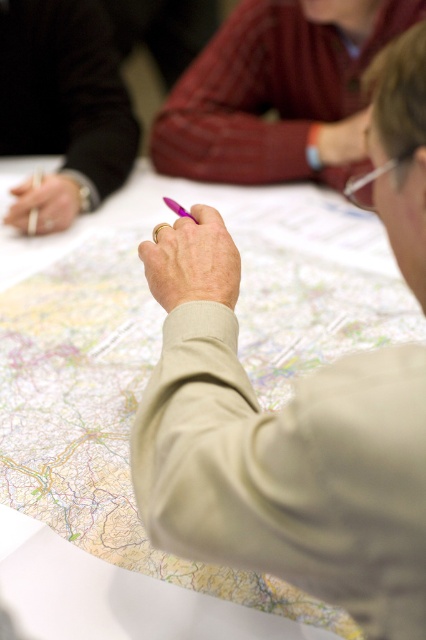
Question: Can you confirm if matte red sweater at upper center is wider than matte black pen at upper left?

Choices:
 (A) no
 (B) yes

Answer: (B)

Question: Which point is closer to the camera?

Choices:
 (A) (368, 8)
 (B) (117, 182)

Answer: (A)

Question: Based on their relative distances, which object is nearer to the matte red sweater at upper center?

Choices:
 (A) purple plastic pen at center
 (B) beige paper map at center

Answer: (B)

Question: Considering the relative positions of beige paper map at center and matte black pen at upper left in the image provided, where is beige paper map at center located with respect to matte black pen at upper left?

Choices:
 (A) left
 (B) right

Answer: (B)

Question: Does beige paper map at center appear on the right side of matte red sweater at upper center?

Choices:
 (A) no
 (B) yes

Answer: (A)

Question: Which of the following is the farthest from the observer?

Choices:
 (A) (34, 54)
 (B) (192, 124)

Answer: (B)